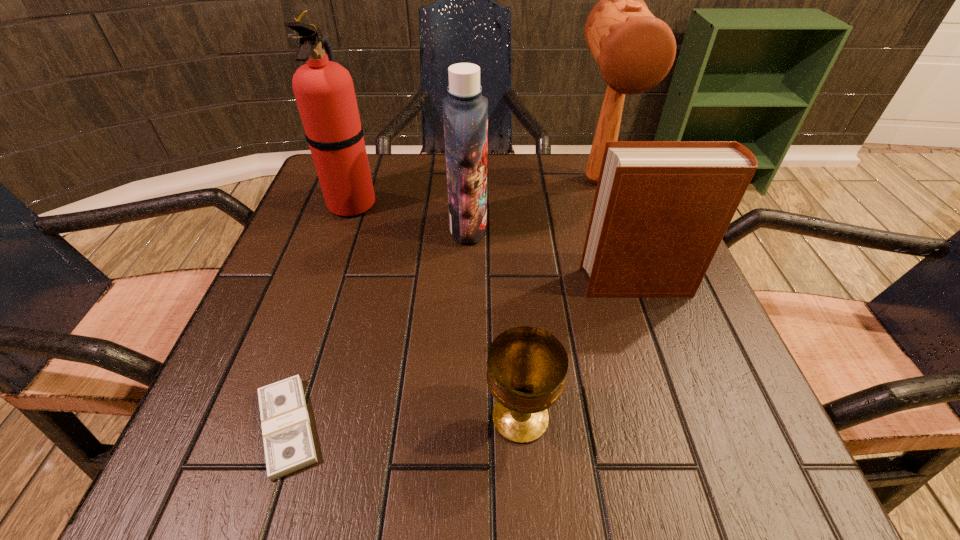
Where is `free space that satisfies the following two spatial constraints: 1. at the nozzle of the fire extinguisher; 2. on the left side of the shortest object`? This screenshot has height=540, width=960. free space that satisfies the following two spatial constraints: 1. at the nozzle of the fire extinguisher; 2. on the left side of the shortest object is located at coordinates (275, 427).